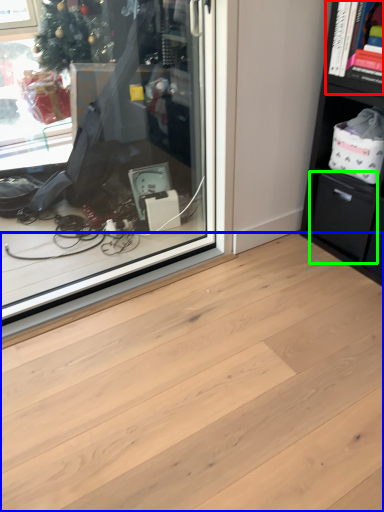
Question: Which is nearer to the cabinet (highlighted by a red box)? plank (highlighted by a blue box) or drawer (highlighted by a green box).

Choices:
 (A) plank
 (B) drawer

Answer: (B)